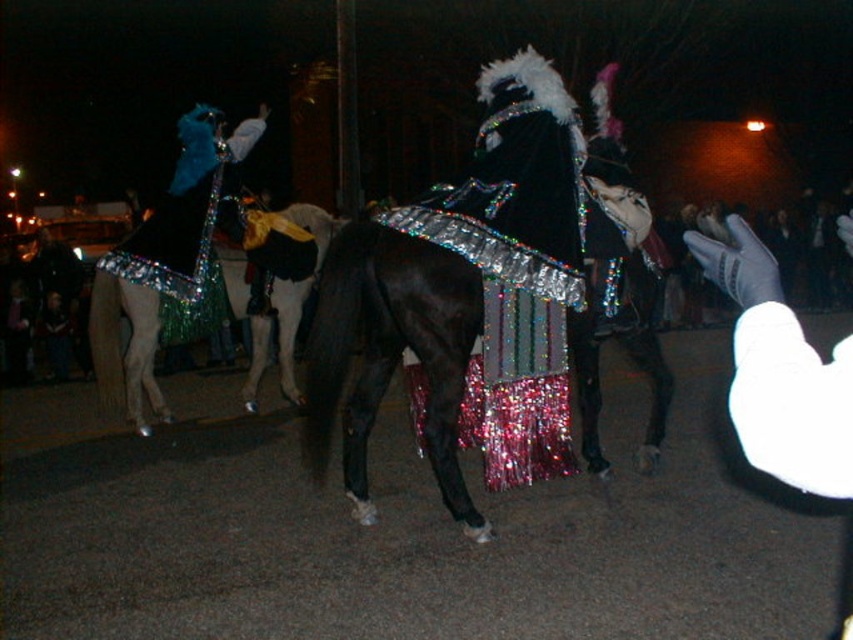
Question: Among these objects, which one is farthest from the camera?

Choices:
 (A) shiny silver horse at center
 (B) holographic sequined cape at center
 (C) shiny green fabric cape at left
 (D) shiny metallic horse at center

Answer: (A)

Question: Considering the relative positions of holographic sequined cape at center and shiny metallic horse at center in the image provided, where is holographic sequined cape at center located with respect to shiny metallic horse at center?

Choices:
 (A) below
 (B) above

Answer: (B)

Question: Does holographic sequined cape at center appear under shiny silver horse at center?

Choices:
 (A) no
 (B) yes

Answer: (A)

Question: Does shiny silver horse at center have a greater width compared to shiny metallic horse at center?

Choices:
 (A) yes
 (B) no

Answer: (A)

Question: Estimate the real-world distances between objects in this image. Which object is closer to the shiny silver horse at center?

Choices:
 (A) holographic sequined cape at center
 (B) shiny metallic horse at center
 (C) shiny green fabric cape at left

Answer: (C)

Question: Which point appears closest to the camera in this image?

Choices:
 (A) (236, 156)
 (B) (491, 301)

Answer: (B)